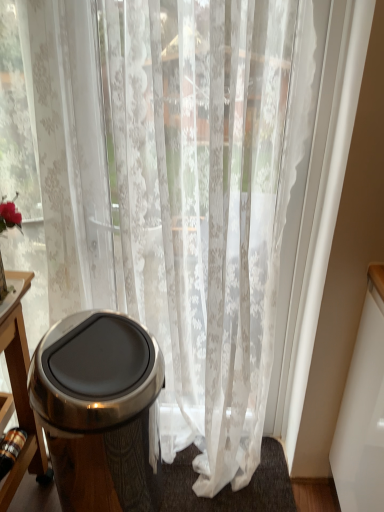
What is the approximate height of polished stainless steel trash can at lower left?

It is 29.13 inches.

The width and height of the screenshot is (384, 512). Describe the element at coordinates (98, 410) in the screenshot. I see `polished stainless steel trash can at lower left` at that location.

In order to face polished stainless steel trash can at lower left, should I rotate leftwards or rightwards?

Rotate left and turn 12.055 degrees.

Find the location of `polished stainless steel trash can at lower left`. polished stainless steel trash can at lower left is located at coordinates (98, 410).

At what (x,y) coordinates should I click in order to perform the action: click on polished stainless steel trash can at lower left. Please return your answer as a coordinate pair (x, y). The height and width of the screenshot is (512, 384). Looking at the image, I should click on (98, 410).